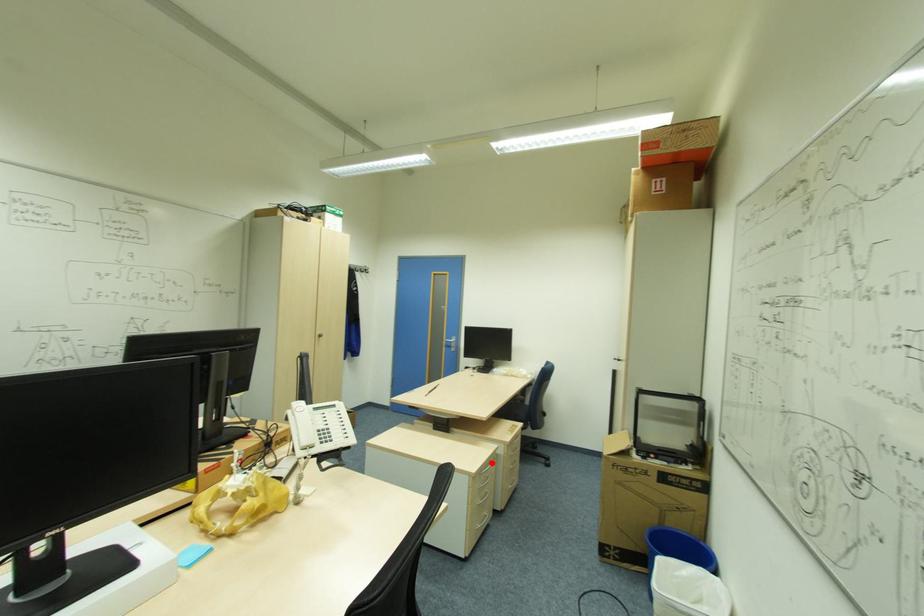
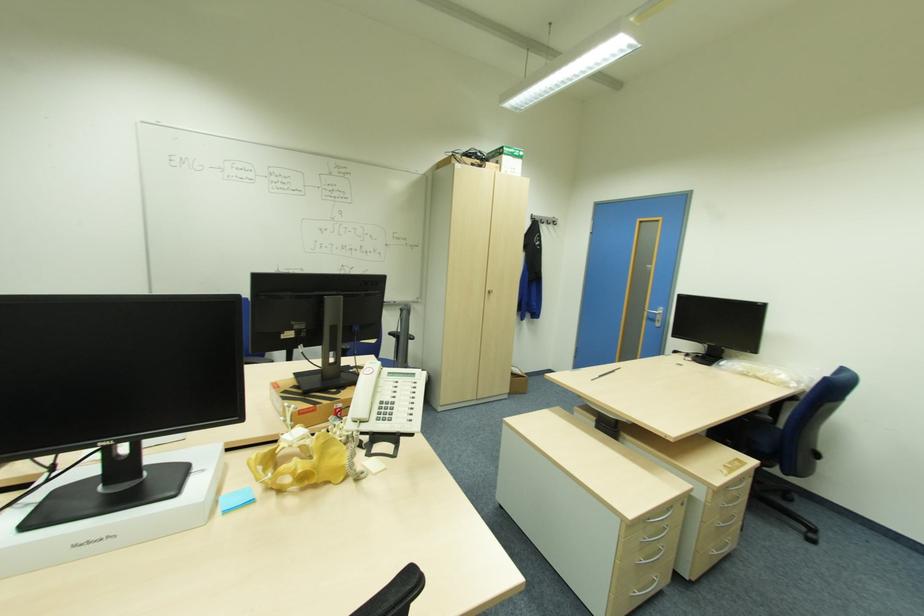
Question: I am providing you with two images of the same scene from different viewpoints. A red point is shown in image1. For the corresponding object point in image2, is it positioned nearer or farther from the camera?

Choices:
 (A) Nearer
 (B) Farther

Answer: (A)